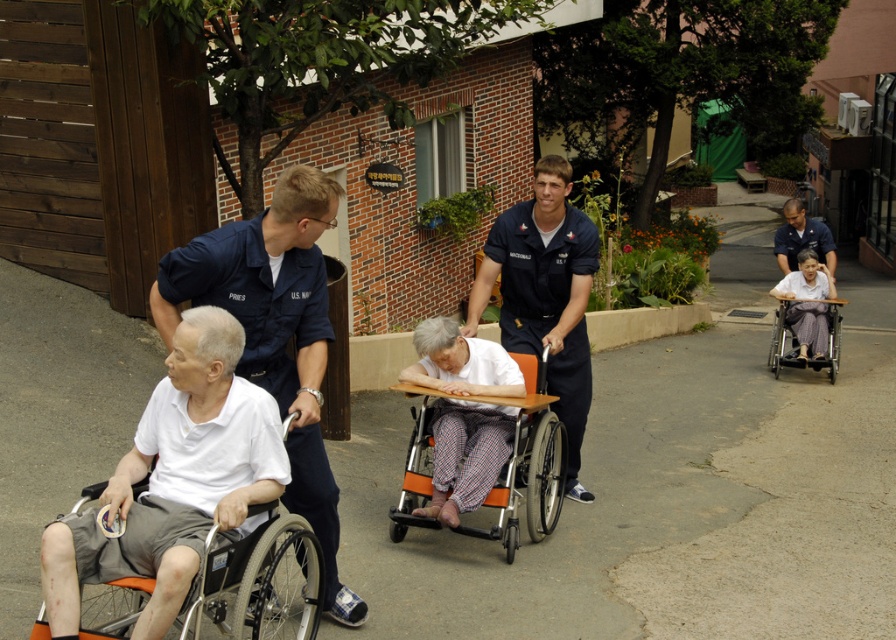
Which is above, matte blue uniform at center or blue uniform shirt at upper right?

Positioned higher is blue uniform shirt at upper right.

Is matte blue uniform at center closer to camera compared to blue uniform shirt at upper right?

Yes.

Is point (342, 612) closer to viewer compared to point (797, 208)?

Yes.

Locate an element on the screen. Image resolution: width=896 pixels, height=640 pixels. matte blue uniform at center is located at coordinates (276, 333).

Is matte blue uniform at center above orange fabric wheelchair at left?

Yes.

Does matte blue uniform at center have a larger size compared to orange fabric wheelchair at left?

Yes, matte blue uniform at center is bigger than orange fabric wheelchair at left.

Where is `matte blue uniform at center`? matte blue uniform at center is located at coordinates (276, 333).

In the scene shown: Which is above, matte blue uniform at center or blue uniform at center?

Positioned higher is blue uniform at center.

Who is lower down, matte blue uniform at center or blue uniform at center?

matte blue uniform at center is below.

Locate an element on the screen. matte blue uniform at center is located at coordinates (276, 333).